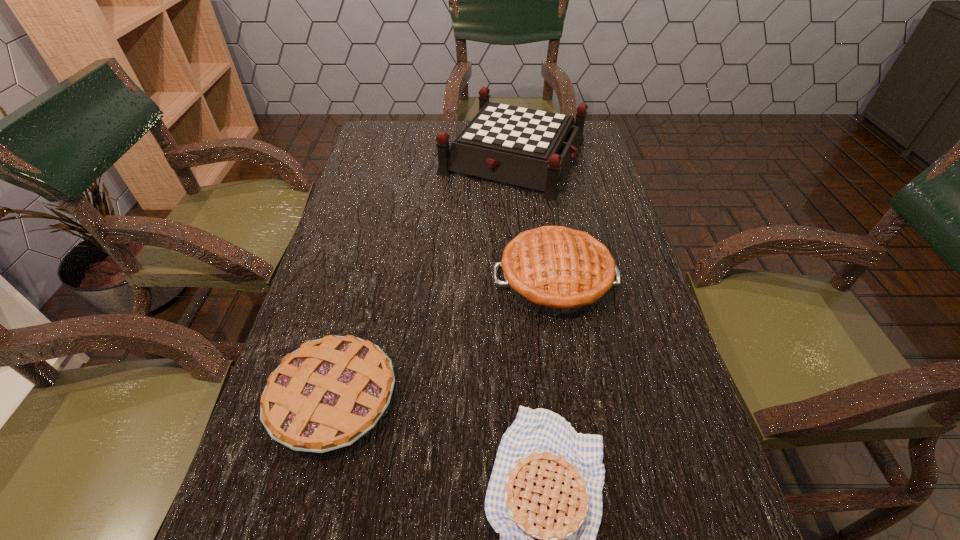
Locate an element on the screen. Image resolution: width=960 pixels, height=540 pixels. checkerboard that is at the right edge is located at coordinates (530, 148).

I want to click on pie at the right edge, so click(x=553, y=270).

Where is `object at the far right corner`? object at the far right corner is located at coordinates (530, 148).

This screenshot has width=960, height=540. In order to click on vacant area at the far edge of the desktop in this screenshot , I will do `click(444, 120)`.

What are the coordinates of `vacant space at the left edge of the desktop` in the screenshot? It's located at (289, 503).

At what (x,y) coordinates should I click in order to perform the action: click on vacant space at the right edge of the desktop. Please return your answer as a coordinate pair (x, y). Image resolution: width=960 pixels, height=540 pixels. Looking at the image, I should click on (604, 199).

In the image, there is a desktop. Identify the location of vacant region at the far left corner. The height and width of the screenshot is (540, 960). (364, 148).

I want to click on empty space between the leftmost object and the second tallest object, so click(x=444, y=339).

Identify the location of vacant space that's between the farthest pie and the leftmost pie. (444, 339).

You are a GUI agent. You are given a task and a screenshot of the screen. Output one action in this format:
    pyautogui.click(x=<x>, y=<y>)
    Task: Click on the free space that is in between the farthest pie and the farthest object
    
    Given the screenshot: What is the action you would take?
    [x=535, y=218]